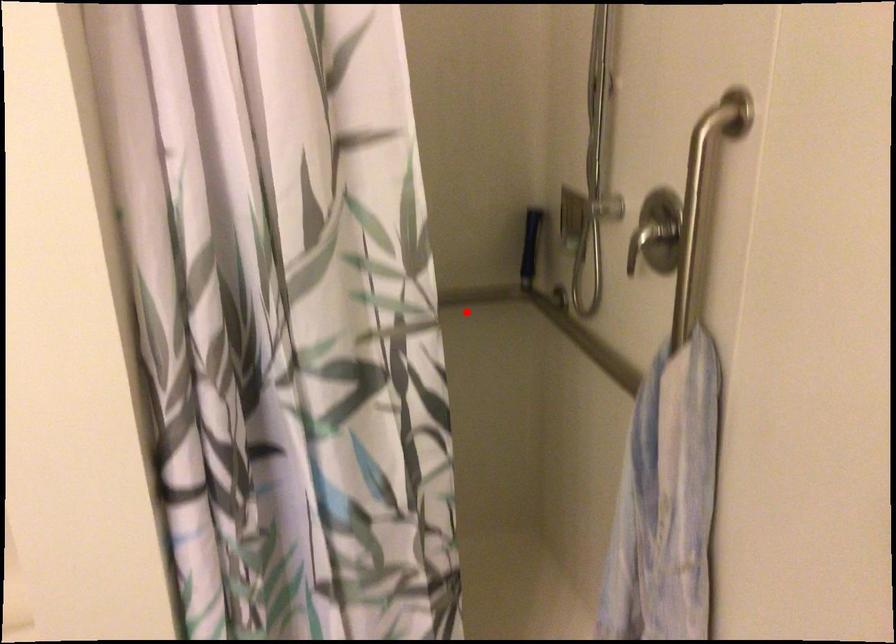
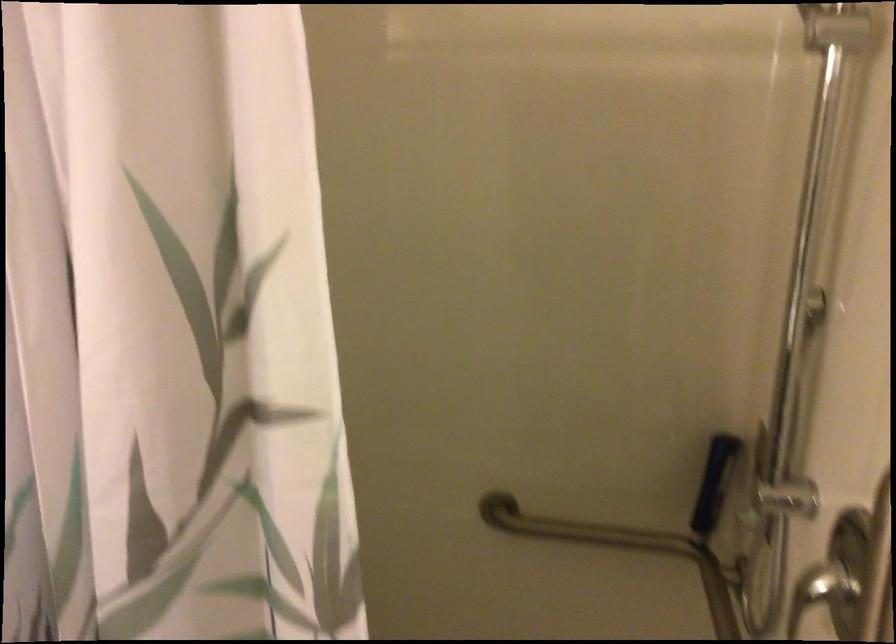
Question: I am providing you with two images of the same scene from different viewpoints. A red point is shown in image1. For the corresponding object point in image2, is it positioned nearer or farther from the camera?

Choices:
 (A) Nearer
 (B) Farther

Answer: (A)